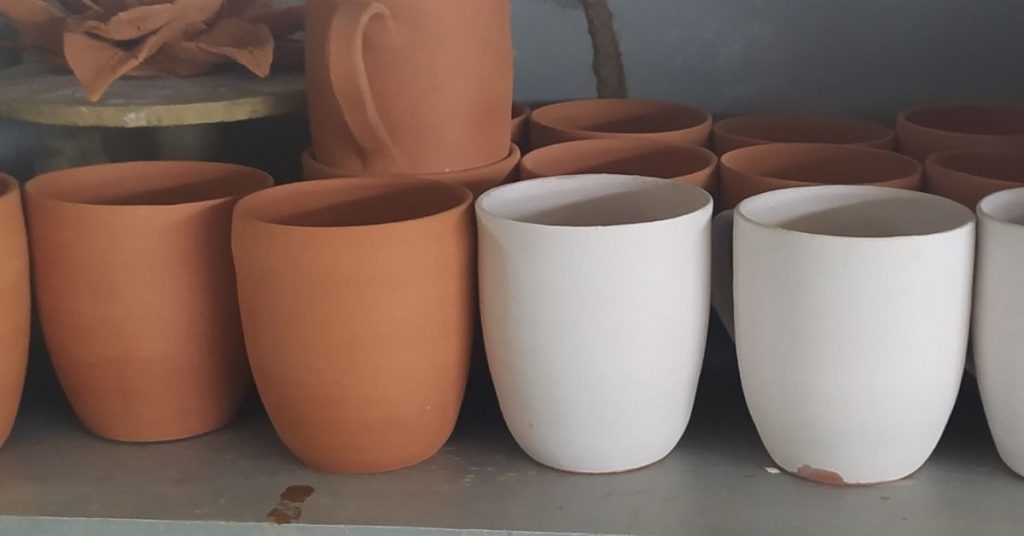
This screenshot has height=536, width=1024. Identify the location of wall. (791, 56).